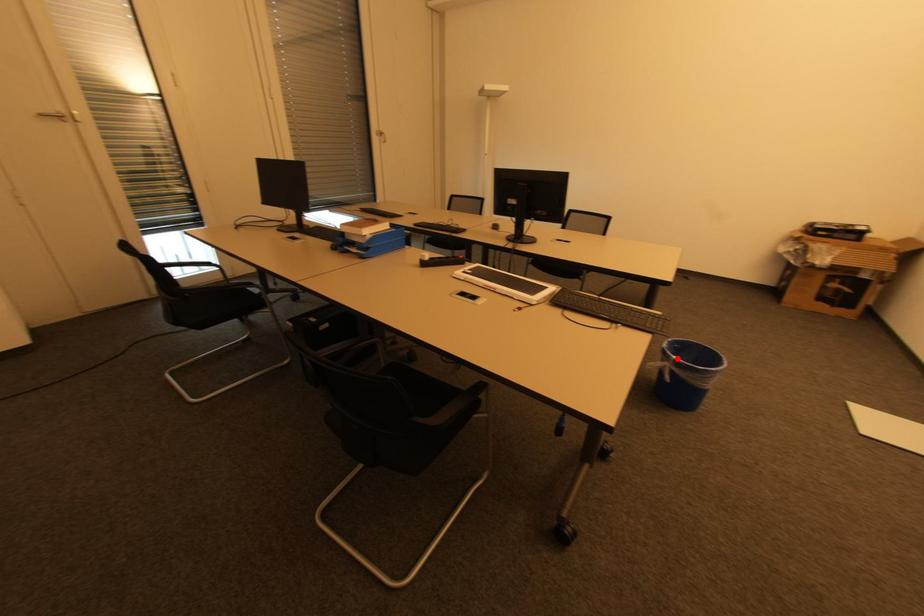
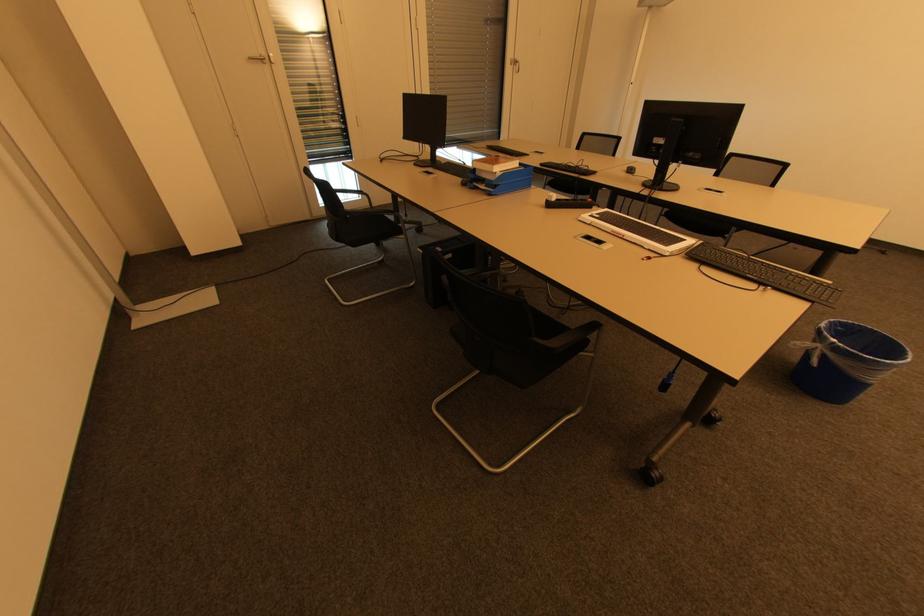
Question: I am providing you with two images of the same scene from different viewpoints. In image1, a red point is highlighted. Considering the same 3D point in image2, which of the following is correct?

Choices:
 (A) It is closer
 (B) It is farther

Answer: (B)